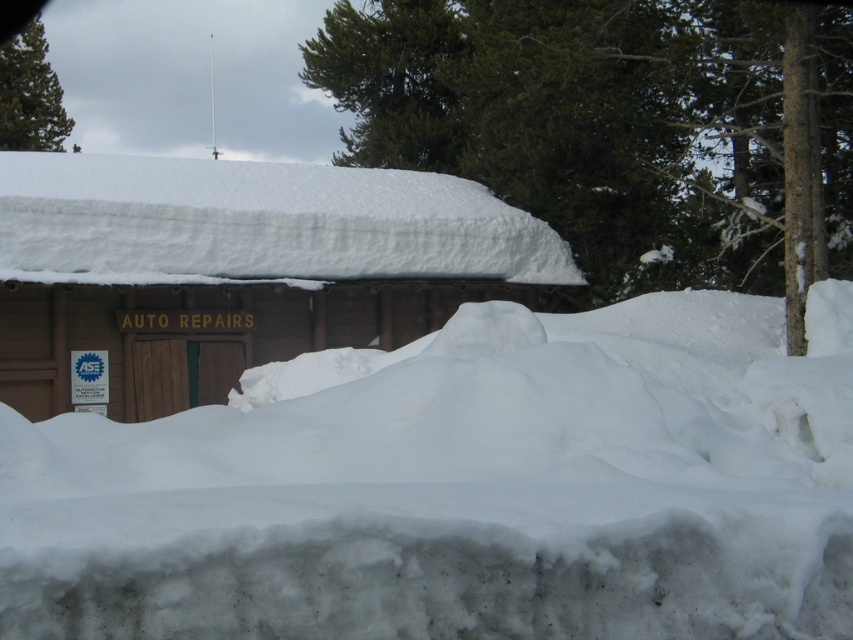
Is white fluffy snow at center positioned behind wooden cabin at center?

No, white fluffy snow at center is in front of wooden cabin at center.

Is point (498, 524) farther from camera compared to point (430, 288)?

No, (498, 524) is closer to viewer.

Who is more distant from viewer, (x=258, y=516) or (x=289, y=234)?

The point (x=289, y=234) is more distant.

Locate an element on the screen. This screenshot has height=640, width=853. white fluffy snow at center is located at coordinates (462, 488).

Can you confirm if white fluffy snow at center is positioned to the right of green matte pine at upper left?

Yes, white fluffy snow at center is to the right of green matte pine at upper left.

Is point (334, 428) more distant than point (55, 131)?

That is False.

Locate an element on the screen. Image resolution: width=853 pixels, height=640 pixels. white fluffy snow at center is located at coordinates (462, 488).

Who is taller, wooden cabin at center or green matte pine at upper left?

With more height is green matte pine at upper left.

Is wooden cabin at center to the right of green matte pine at upper left from the viewer's perspective?

Indeed, wooden cabin at center is positioned on the right side of green matte pine at upper left.

I want to click on wooden cabin at center, so click(234, 269).

At what (x,y) coordinates should I click in order to perform the action: click on wooden cabin at center. Please return your answer as a coordinate pair (x, y). The width and height of the screenshot is (853, 640). Looking at the image, I should click on (234, 269).